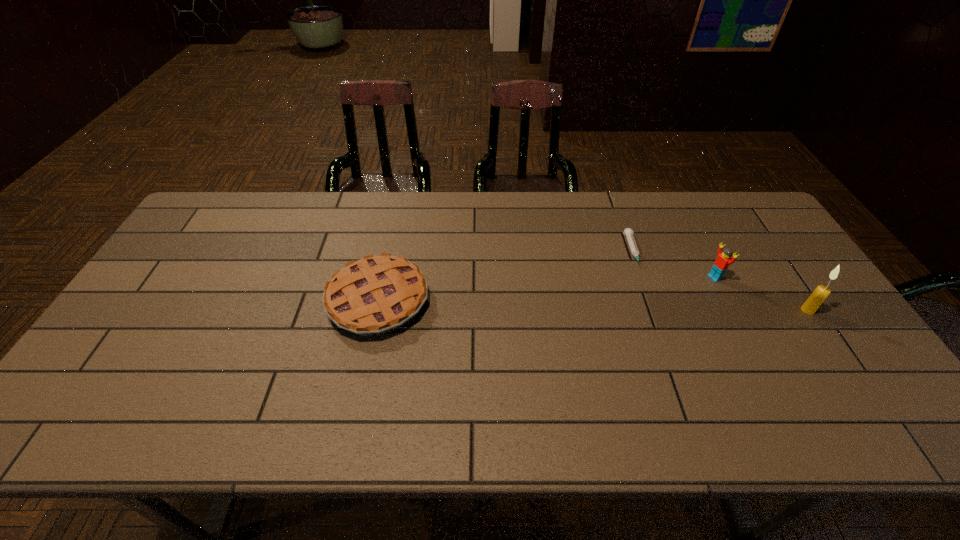
Locate an element on the screen. free space on the desktop that is between the third tallest object and the candle and is positioned on the face of the second object from right to left is located at coordinates coord(656,307).

Identify the location of free spot on the desktop that is between the pie and the rightmost object and is positioned at the needle end of the second object from left to right. (652, 307).